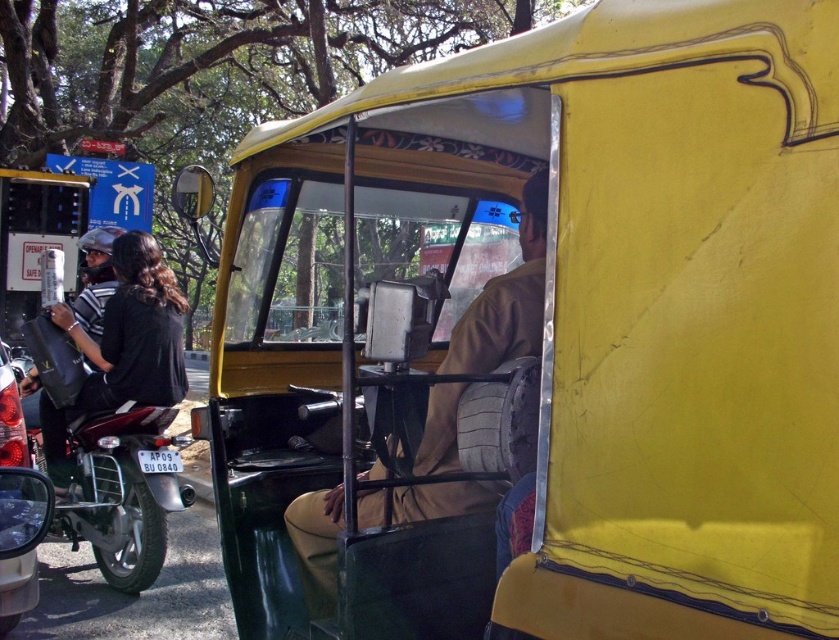
You are standing at point (157, 380) and want to walk to point (466, 506). Is the destination point in front of or behind you?

The destination point (466, 506) is in front of point (157, 380), so it is in front of you.

Looking at this image, you are a traveler who wants to sit on the light brown fabric seat at center. Can you also fit your backpack on the shiny black motorcycle at left along with the seat?

The light brown fabric seat at center is smaller than the shiny black motorcycle at left, so the backpack may not fit on the shiny black motorcycle at left along with the seat.

You are a delivery person who needs to place a large package between the light brown fabric seat at center and the shiny black motorcycle at left. The package is 8 feet long. Can you fit it between them?

The distance between the light brown fabric seat at center and the shiny black motorcycle at left is 7.59 feet, which is shorter than the package length of 8 feet. Therefore, the package cannot fit between them.